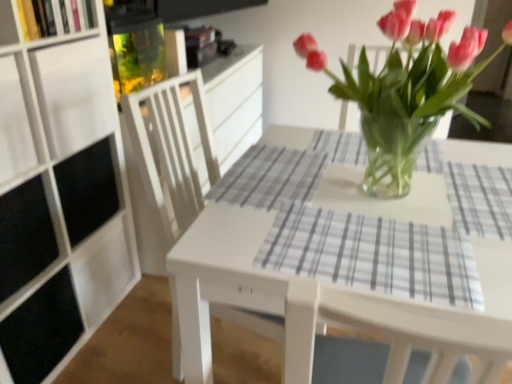
Question: Looking at their shapes, would you say white wood chair at center is wider or thinner than gray plaid placemat at center?

Choices:
 (A) thin
 (B) wide

Answer: (B)

Question: Would you say white wood chair at center is inside or outside gray plaid placemat at center?

Choices:
 (A) outside
 (B) inside

Answer: (A)

Question: Based on their relative distances, which object is nearer to the white wood chair at center?

Choices:
 (A) wooden bookshelf at upper left, the 2th shelf positioned from the bottom
 (B) white matte cabinet at left
 (C) white glossy table at center
 (D) pink glass vase at center
 (E) gray plaid placemat at center

Answer: (C)

Question: Estimate the real-world distances between objects in this image. Which object is farther from the white matte cabinet at left?

Choices:
 (A) white matte shelf at upper left, which is counted as the 2th shelf, starting from the top
 (B) pink glass vase at center
 (C) white glossy table at center
 (D) white wood chair at center
 (E) wooden bookshelf at upper left, marked as the first shelf in a top-to-bottom arrangement

Answer: (B)